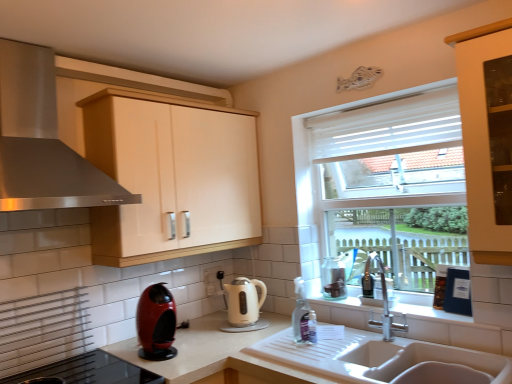
Question: Considering the positions of shiny red coffee machine at lower left, positioned as the 1th kitchen appliance in left-to-right order, and white ceramic sink at lower center in the image, is shiny red coffee machine at lower left, positioned as the 1th kitchen appliance in left-to-right order, bigger or smaller than white ceramic sink at lower center?

Choices:
 (A) small
 (B) big

Answer: (A)

Question: Is point (159, 334) closer or farther from the camera than point (357, 347)?

Choices:
 (A) closer
 (B) farther

Answer: (B)

Question: Which object is the farthest from the white glossy electric kettle at center, which is the second kitchen appliance from left to right?

Choices:
 (A) stainless steel range hood at upper left
 (B) white matte countertop at sink
 (C) white ceramic sink at lower center
 (D) shiny red coffee machine at lower left, arranged as the 1th kitchen appliance when viewed from the front
 (E) matte cream cabinet at upper center

Answer: (A)

Question: Estimate the real-world distances between objects in this image. Which object is closer to the stainless steel range hood at upper left?

Choices:
 (A) white matte countertop at sink
 (B) clear glass jar at right
 (C) white ceramic sink at lower center
 (D) white glossy electric kettle at center, the first kitchen appliance in the back-to-front sequence
 (E) shiny red coffee machine at lower left, which ranks as the 2th kitchen appliance in back-to-front order

Answer: (E)